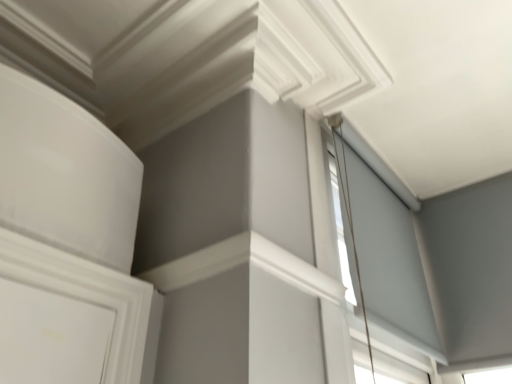
Locate an element on the screen. Image resolution: width=512 pixels, height=384 pixels. white matte window at upper center is located at coordinates (382, 252).

What is the approximate width of white matte window at upper center?

3.90 inches.

What do you see at coordinates (382, 252) in the screenshot? The width and height of the screenshot is (512, 384). I see `white matte window at upper center` at bounding box center [382, 252].

At what (x,y) coordinates should I click in order to perform the action: click on white matte window at upper center. Please return your answer as a coordinate pair (x, y). The width and height of the screenshot is (512, 384). Looking at the image, I should click on (382, 252).